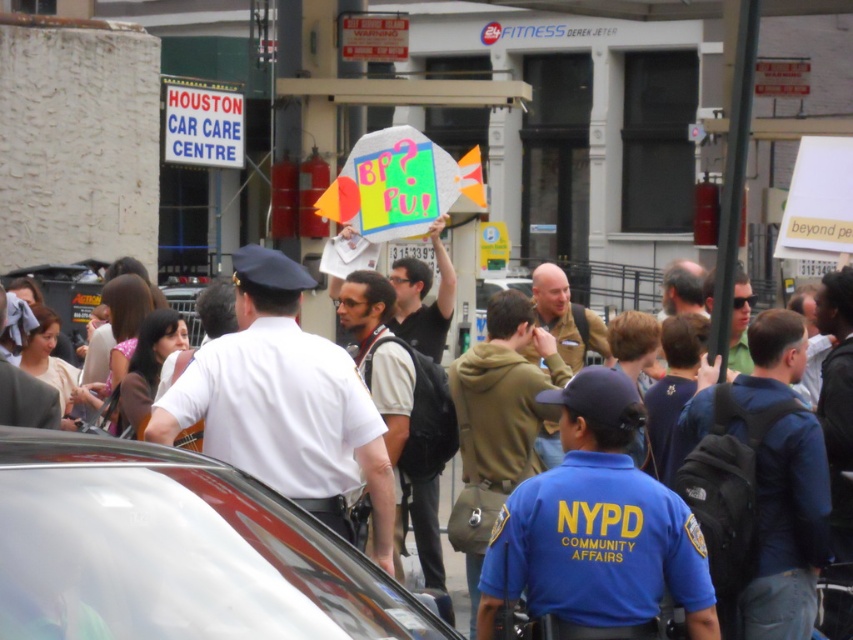
Question: Which of the following is the farthest from the observer?

Choices:
 (A) dark brown leather backpack at center
 (B) blue fabric backpack at center-right
 (C) shiny silver car at center
 (D) white uniform shirt at center

Answer: (A)

Question: Can you confirm if shiny silver car at center is positioned below blue fabric backpack at center-right?

Choices:
 (A) no
 (B) yes

Answer: (B)

Question: Is red plastic sign at upper left thinner than light brown fabric jacket at lower left?

Choices:
 (A) no
 (B) yes

Answer: (A)

Question: Which point is closer to the camera?

Choices:
 (A) (424, 266)
 (B) (537, 355)
 (C) (241, 141)
 (D) (3, 401)

Answer: (D)

Question: Which point is closer to the camera?

Choices:
 (A) red plastic sign at upper left
 (B) khaki uniform at center
 (C) matte black backpack at center

Answer: (C)

Question: Does matte black backpack at center appear under matte black sunglasses at center?

Choices:
 (A) no
 (B) yes

Answer: (A)